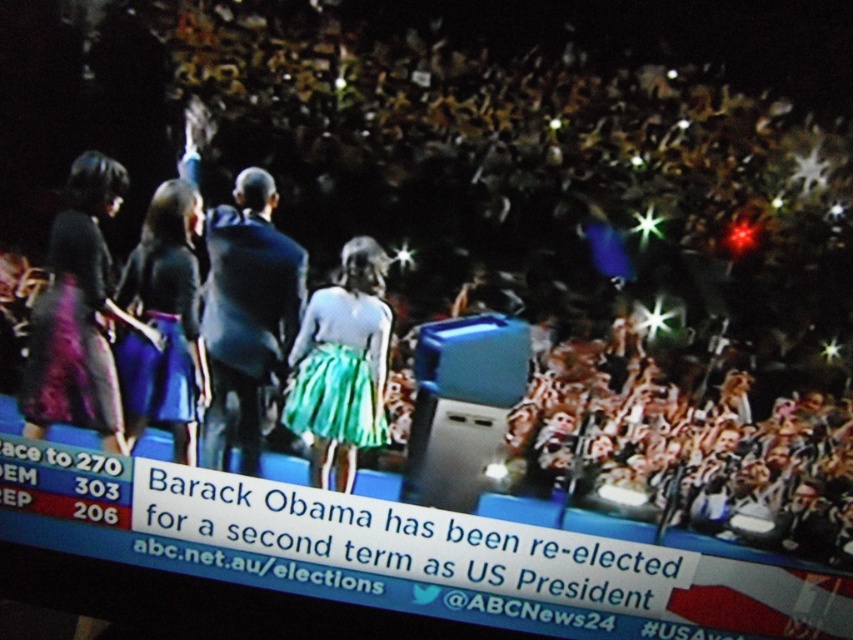
Question: Is teal satin skirt at center wider than matte black dress at left?

Choices:
 (A) no
 (B) yes

Answer: (B)

Question: Which point appears closest to the camera in this image?

Choices:
 (A) pyautogui.click(x=175, y=269)
 (B) pyautogui.click(x=271, y=296)

Answer: (B)

Question: Can you confirm if dark blue suit at center is wider than teal satin skirt at center?

Choices:
 (A) no
 (B) yes

Answer: (B)

Question: Which point is farther to the camera?

Choices:
 (A) matte black dress at left
 (B) teal satin skirt at center
 (C) dark blue suit at center
 (D) matte purple skirt at left

Answer: (A)

Question: Which of these objects is positioned farthest from the teal satin skirt at center?

Choices:
 (A) matte black dress at left
 (B) dark blue suit at center

Answer: (A)

Question: Does dark blue suit at center have a larger size compared to teal satin skirt at center?

Choices:
 (A) no
 (B) yes

Answer: (B)